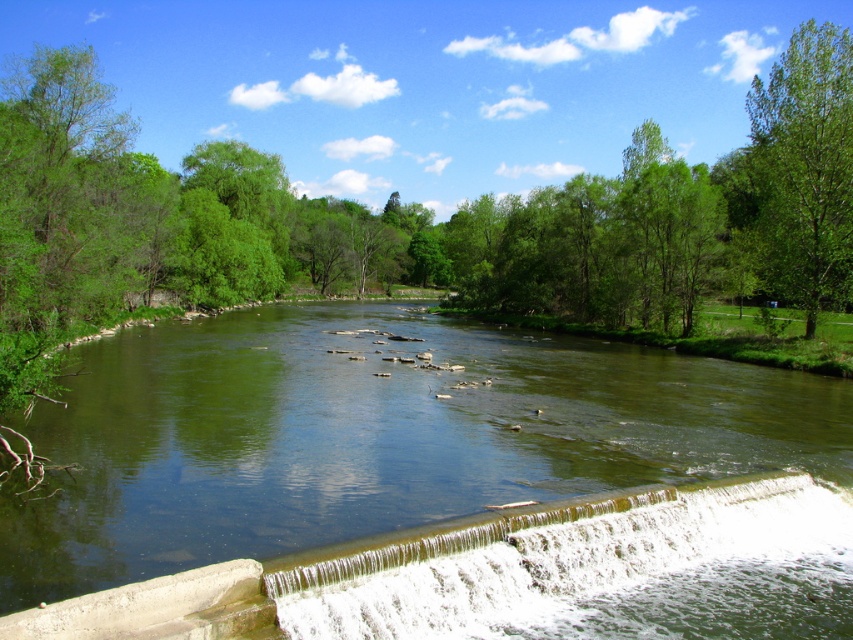
Does white frothy water at lower center appear over green leafy tree at upper right?

No, white frothy water at lower center is not above green leafy tree at upper right.

Is white frothy water at lower center thinner than green leafy tree at upper right?

Yes.

Is point (514, 547) positioned in front of point (834, 129)?

Yes, it is.

At what (x,y) coordinates should I click in order to perform the action: click on white frothy water at lower center. Please return your answer as a coordinate pair (x, y). Image resolution: width=853 pixels, height=640 pixels. Looking at the image, I should click on (601, 573).

Which is more to the left, green smooth river at center or green leafy tree at upper right?

green smooth river at center

Which of these two, green smooth river at center or green leafy tree at upper right, stands taller?

green leafy tree at upper right is taller.

Describe the element at coordinates (370, 436) in the screenshot. I see `green smooth river at center` at that location.

This screenshot has height=640, width=853. What are the coordinates of `green smooth river at center` in the screenshot? It's located at (370, 436).

Between point (381, 442) and point (422, 618), which one is positioned behind?

The point (381, 442) is behind.

Locate an element on the screen. Image resolution: width=853 pixels, height=640 pixels. green smooth river at center is located at coordinates (370, 436).

The height and width of the screenshot is (640, 853). I want to click on green smooth river at center, so [370, 436].